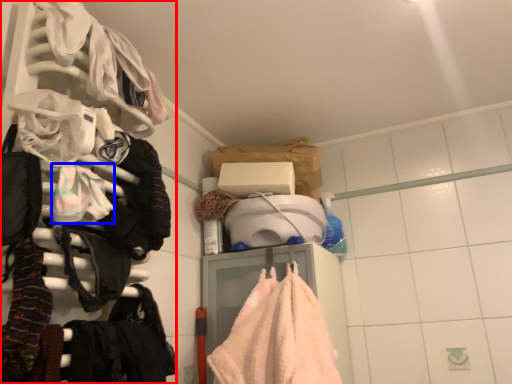
Question: Among these objects, which one is nearest to the camera, closet (highlighted by a red box) or clothing (highlighted by a blue box)?

Choices:
 (A) closet
 (B) clothing

Answer: (A)